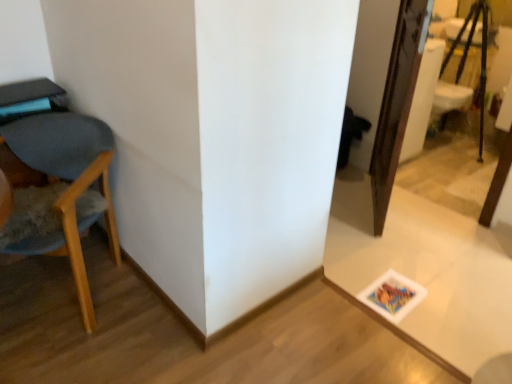
Question: Can you confirm if white glossy table at lower right is smaller than wooden chair at left?

Choices:
 (A) no
 (B) yes

Answer: (B)

Question: From a real-world perspective, is white glossy table at lower right below wooden chair at left?

Choices:
 (A) no
 (B) yes

Answer: (B)

Question: Is white glossy table at lower right positioned with its back to wooden chair at left?

Choices:
 (A) yes
 (B) no

Answer: (B)

Question: Can you confirm if white glossy table at lower right is shorter than wooden chair at left?

Choices:
 (A) no
 (B) yes

Answer: (B)

Question: From a real-world perspective, is white glossy table at lower right over wooden chair at left?

Choices:
 (A) no
 (B) yes

Answer: (A)

Question: Is wooden chair at left taller or shorter than white glossy table at lower right?

Choices:
 (A) tall
 (B) short

Answer: (A)

Question: From the image's perspective, is wooden chair at left above or below white glossy table at lower right?

Choices:
 (A) above
 (B) below

Answer: (A)

Question: From a real-world perspective, is wooden chair at left above or below white glossy table at lower right?

Choices:
 (A) below
 (B) above

Answer: (B)

Question: Is point (96, 127) positioned closer to the camera than point (451, 360)?

Choices:
 (A) farther
 (B) closer

Answer: (A)

Question: Considering their positions, is wooden chair at left located in front of or behind wooden tripod at upper right?

Choices:
 (A) behind
 (B) front

Answer: (B)

Question: From a real-world perspective, is wooden chair at left physically located above or below wooden tripod at upper right?

Choices:
 (A) above
 (B) below

Answer: (B)

Question: Is wooden chair at left bigger or smaller than wooden tripod at upper right?

Choices:
 (A) small
 (B) big

Answer: (B)

Question: Is point [80, 256] closer or farther from the camera than point [505, 145]?

Choices:
 (A) closer
 (B) farther

Answer: (A)

Question: Based on their sizes in the image, would you say white glossy table at lower right is bigger or smaller than wooden tripod at upper right?

Choices:
 (A) big
 (B) small

Answer: (B)

Question: Is point (369, 178) closer or farther from the camera than point (504, 198)?

Choices:
 (A) farther
 (B) closer

Answer: (A)